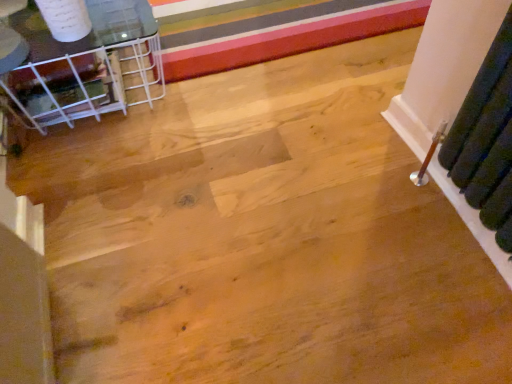
You are a GUI agent. You are given a task and a screenshot of the screen. Output one action in this format:
    pyautogui.click(x=<x>, y=<y>)
    Task: Click on the vacant space that's between clear glass table at upper left and multicolored striped carpet at upper center
    
    Given the screenshot: What is the action you would take?
    pyautogui.click(x=276, y=68)